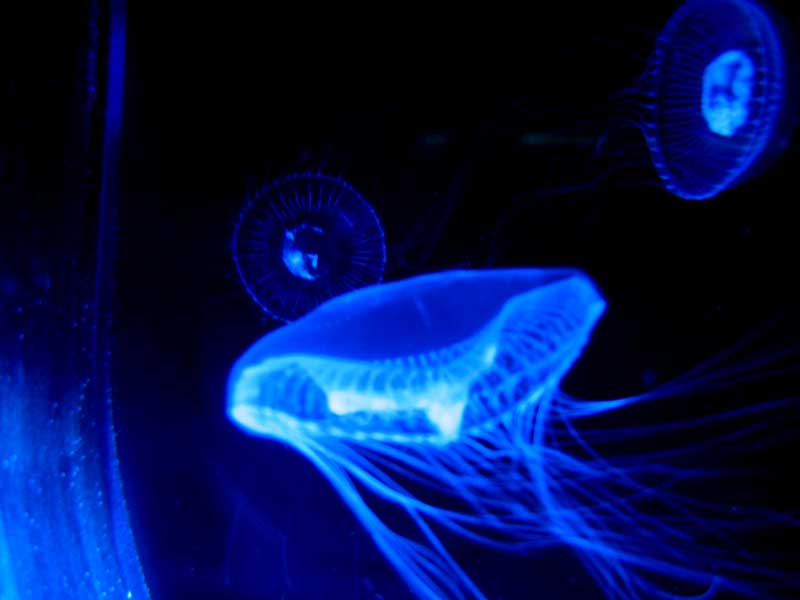
You are a GUI agent. You are given a task and a screenshot of the screen. Output one action in this format:
    pyautogui.click(x=<x>, y=<y>)
    Task: Click on the frame
    
    Given the screenshot: What is the action you would take?
    pyautogui.click(x=332, y=262)